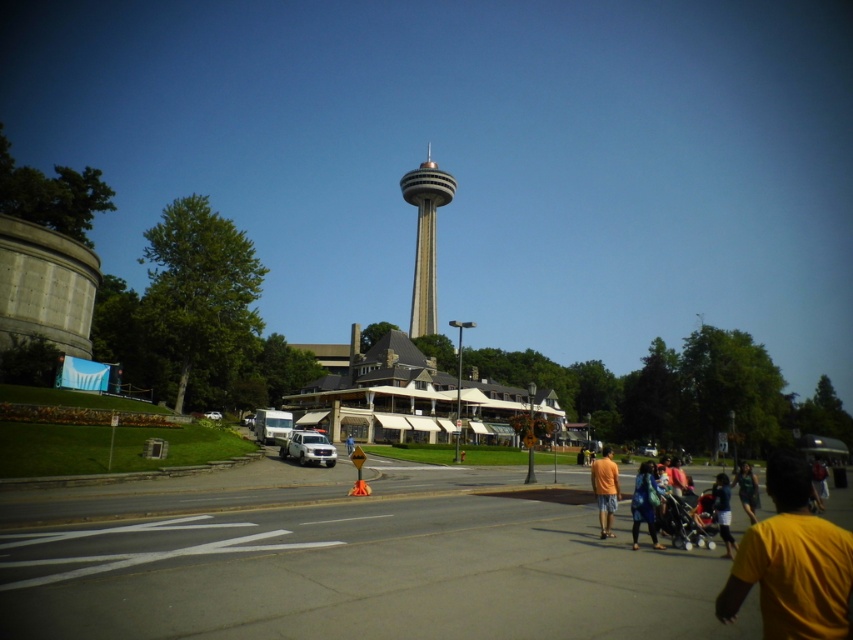
Who is lower down, yellow matte shirt at lower right or gray concrete tower at center?

yellow matte shirt at lower right is lower down.

Can you confirm if yellow matte shirt at lower right is wider than gray concrete tower at center?

In fact, yellow matte shirt at lower right might be narrower than gray concrete tower at center.

Does point (805, 609) come closer to viewer compared to point (440, 193)?

Yes, point (805, 609) is in front of point (440, 193).

What are the coordinates of `yellow matte shirt at lower right` in the screenshot? It's located at (792, 563).

Describe the element at coordinates (425, 237) in the screenshot. I see `gray concrete tower at center` at that location.

Is gray concrete tower at center further to the viewer compared to green fabric shirt at lower right?

Yes, it is.

I want to click on gray concrete tower at center, so click(x=425, y=237).

Is yellow matte shirt at lower right below blue fabric bag at lower center?

Incorrect, yellow matte shirt at lower right is not positioned below blue fabric bag at lower center.

Does point (839, 529) come behind point (653, 536)?

No, (839, 529) is in front of (653, 536).

Is point (770, 577) more distant than point (637, 483)?

No, (770, 577) is closer to viewer.

Locate an element on the screen. yellow matte shirt at lower right is located at coordinates (792, 563).